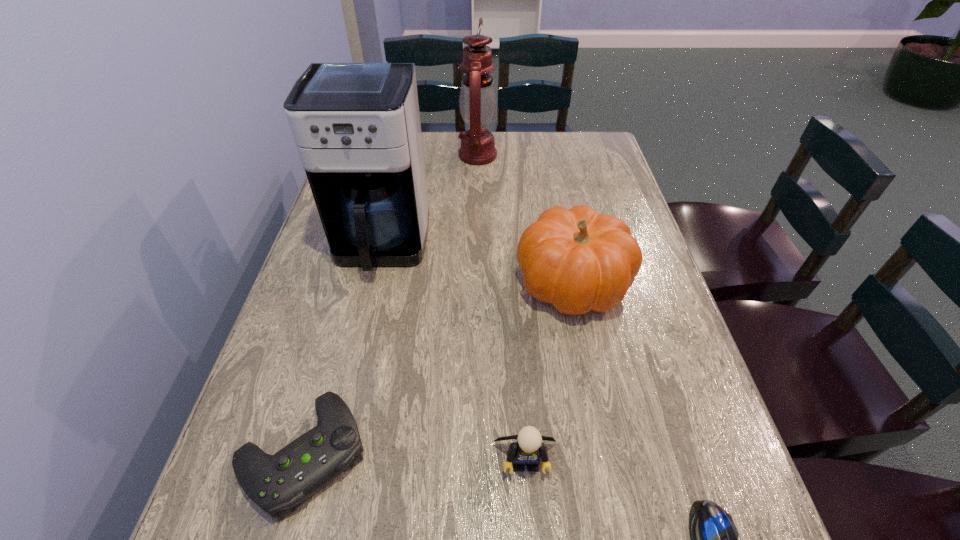
At what (x,y) coordinates should I click in order to perform the action: click on unoccupied position between the fifth tallest object and the Lego. Please return your answer as a coordinate pair (x, y). Looking at the image, I should click on (414, 456).

This screenshot has height=540, width=960. In order to click on free area in between the coffee maker and the Lego in this screenshot , I will do `click(453, 353)`.

Where is `empty space between the pumpkin and the fourth tallest object`? Image resolution: width=960 pixels, height=540 pixels. empty space between the pumpkin and the fourth tallest object is located at coordinates (549, 371).

Locate an element on the screen. The width and height of the screenshot is (960, 540). vacant space in between the pumpkin and the coffee maker is located at coordinates (477, 264).

I want to click on unoccupied area between the oil lamp and the coffee maker, so click(430, 200).

Locate which object is the third closest to the fifth tallest object. Please provide its 2D coordinates. Your answer should be formatted as a tuple, i.e. [(x, y)], where the tuple contains the x and y coordinates of a point satisfying the conditions above.

[(577, 260)]

Point out which object is positioned as the third nearest to the shortest object. Please provide its 2D coordinates. Your answer should be formatted as a tuple, i.e. [(x, y)], where the tuple contains the x and y coordinates of a point satisfying the conditions above.

[(276, 483)]

Where is `free space that satisfies the following two spatial constraints: 1. on the front side of the pumpkin; 2. on the right side of the farthest object`? This screenshot has height=540, width=960. free space that satisfies the following two spatial constraints: 1. on the front side of the pumpkin; 2. on the right side of the farthest object is located at coordinates (477, 282).